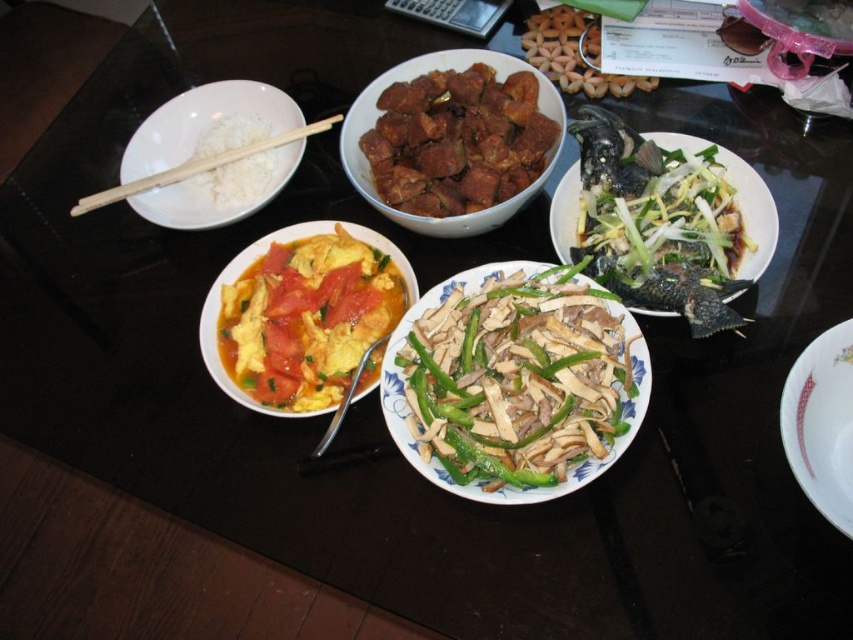
Which is more to the left, green matte vegetables at center or tomato-based omelette at center?

Positioned to the left is tomato-based omelette at center.

Looking at this image, between green matte vegetables at center and tomato-based omelette at center, which one is positioned higher?

tomato-based omelette at center

Where is `green matte vegetables at center`? green matte vegetables at center is located at coordinates (514, 381).

Between point (404, 276) and point (508, 76), which one is positioned in front?

Point (404, 276)

Is tomato-based omelette at center smaller than brown glossy meat at center?

Correct, tomato-based omelette at center occupies less space than brown glossy meat at center.

Which is in front, point (294, 337) or point (369, 125)?

Point (294, 337) is more forward.

Locate an element on the screen. The image size is (853, 640). tomato-based omelette at center is located at coordinates (306, 316).

Between tomato-based omelette at center and green glazed fish at upper right, which one has less height?

Standing shorter between the two is green glazed fish at upper right.

Is the position of tomato-based omelette at center more distant than that of green glazed fish at upper right?

Yes, tomato-based omelette at center is behind green glazed fish at upper right.

Between point (262, 378) and point (752, 264), which one is positioned behind?

The point (262, 378) is more distant.

Where is `tomato-based omelette at center`? The image size is (853, 640). tomato-based omelette at center is located at coordinates (306, 316).